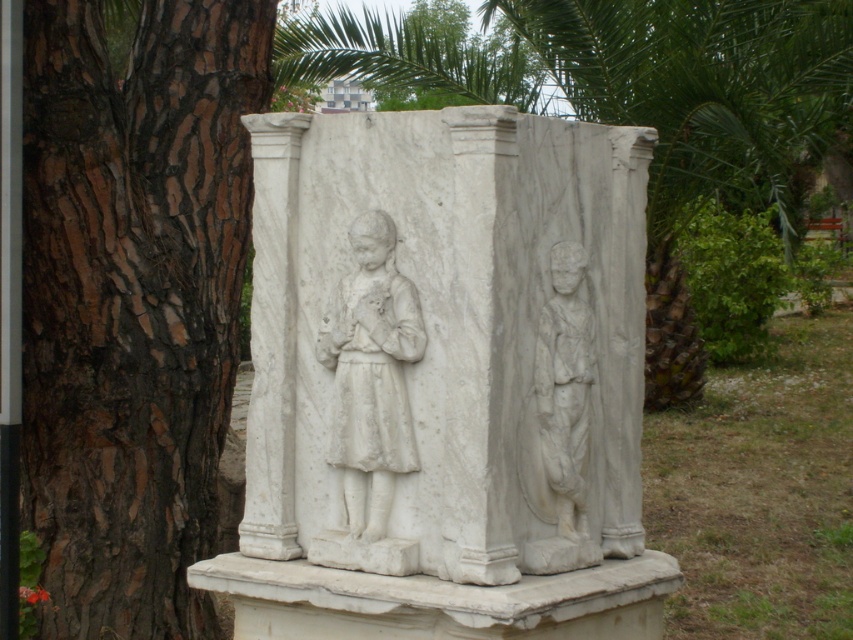
Based on the photo, you are a photographer standing at the base of the marble monument. You notice two points marked on the monument. The first point is at coordinates point [215,396] and the second is at point [558,433]. Which point is closer to your camera lens?

Point [215,396] is closer to the camera lens because it is further to the camera than point [558,433].

You are a visitor standing in front of the monument and want to take a photo of both the brown rough bark tree at left and the white marble statue at right. Based on their positions, which one should you adjust your camera angle to include first?

The brown rough bark tree at left is to the left of the white marble statue at right, so you should adjust your camera angle to include the brown rough bark tree at left first before capturing the white marble statue at right.